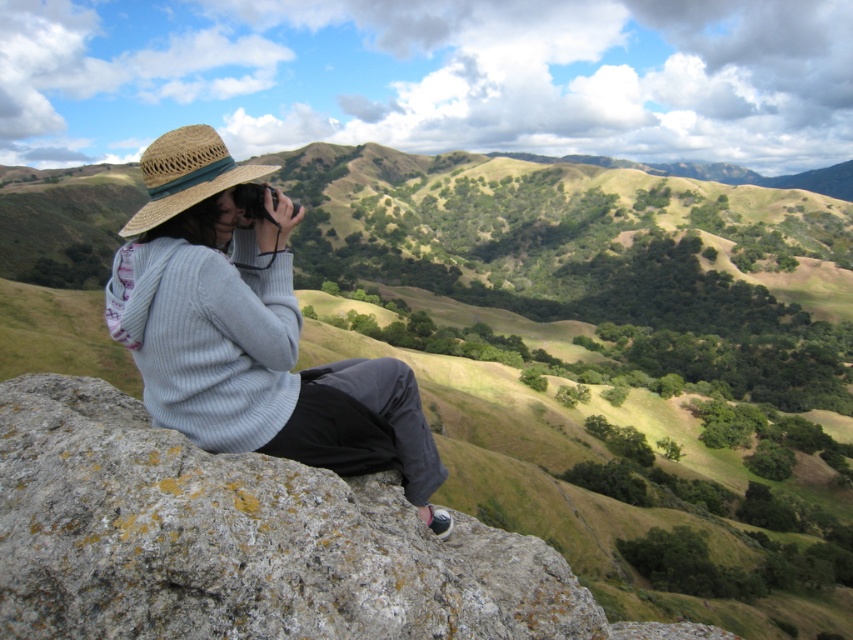
Question: Which of the following is the farthest from the observer?

Choices:
 (A) gray rough rock at center
 (B) strawmaterial/texturehat at left
 (C) straw hat at left

Answer: (C)

Question: Where is gray rough rock at center located in relation to straw hat at left in the image?

Choices:
 (A) left
 (B) right

Answer: (A)

Question: Which is nearer to the strawmaterial/texturehat at left?

Choices:
 (A) straw hat at left
 (B) gray rough rock at center

Answer: (B)

Question: Is gray rough rock at center smaller than strawmaterial/texturehat at left?

Choices:
 (A) yes
 (B) no

Answer: (A)

Question: Does gray rough rock at center appear under strawmaterial/texturehat at left?

Choices:
 (A) yes
 (B) no

Answer: (A)

Question: Which of the following is the farthest from the observer?

Choices:
 (A) straw hat at left
 (B) gray rough rock at center

Answer: (A)